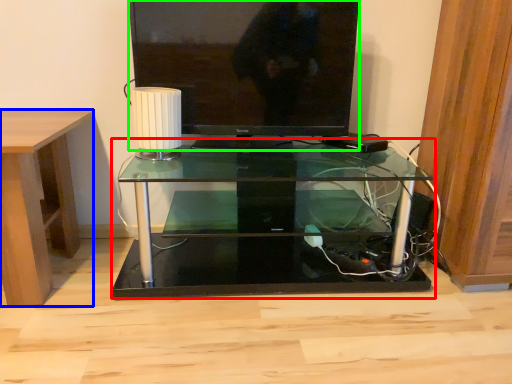
Question: Which object is the closest to the table (highlighted by a red box)? Choose among these: desk (highlighted by a blue box) or television (highlighted by a green box).

Choices:
 (A) desk
 (B) television

Answer: (B)